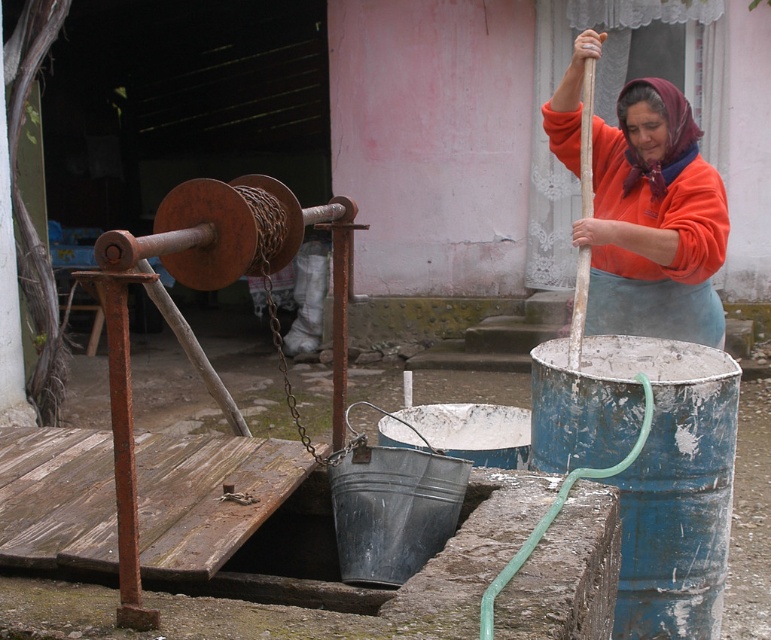
You are a farmer who needs to fill the orange fleece at center with water from the well. The blue metallic barrel at lower right is blocking your path. Can you walk around it to reach the well?

The blue metallic barrel at lower right is in front of orange fleece at center, meaning the barrel is closer to you. You can walk around the barrel to reach the well as long as there is space beside it.

You are a farmer needing to store water collected from the well. You have two options available in the scene, the blue metallic barrel at lower right and the orange fleece at center. Which container can hold more water based on their sizes?

The orange fleece at center can hold more water because it occupies more space than the blue metallic barrel at lower right.